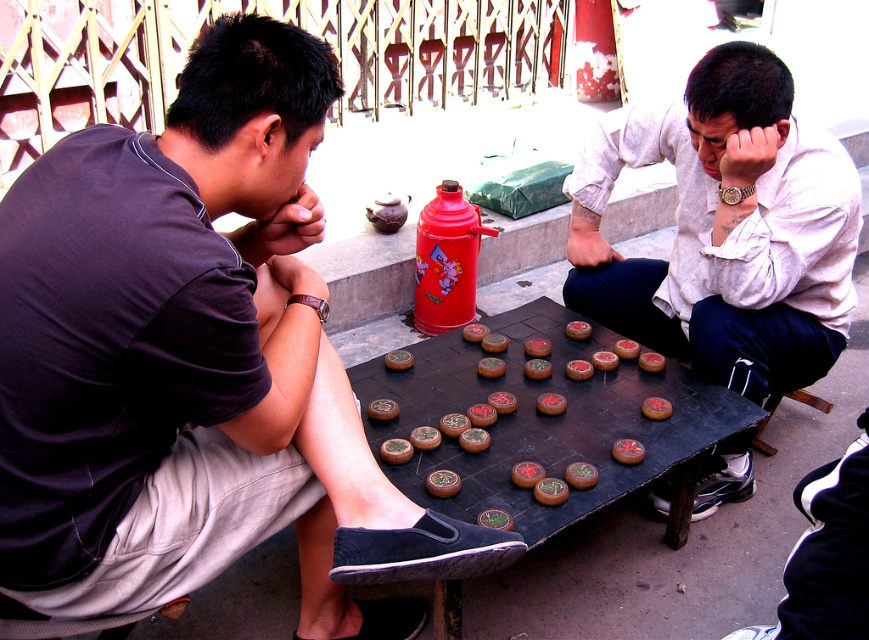
Question: Among these points, which one is farthest from the camera?

Choices:
 (A) (244, 104)
 (B) (688, 244)

Answer: (B)

Question: Which object appears closest to the camera in this image?

Choices:
 (A) matte white shirt at center
 (B) matte black shirt at left

Answer: (B)

Question: Is matte black shirt at left behind matte white shirt at center?

Choices:
 (A) yes
 (B) no

Answer: (B)

Question: Which object is farther from the camera taking this photo?

Choices:
 (A) matte black shirt at left
 (B) matte white shirt at center

Answer: (B)

Question: From the image, what is the correct spatial relationship of matte black shirt at left in relation to matte white shirt at center?

Choices:
 (A) left
 (B) right

Answer: (A)

Question: Can you confirm if matte black shirt at left is thinner than matte white shirt at center?

Choices:
 (A) no
 (B) yes

Answer: (A)